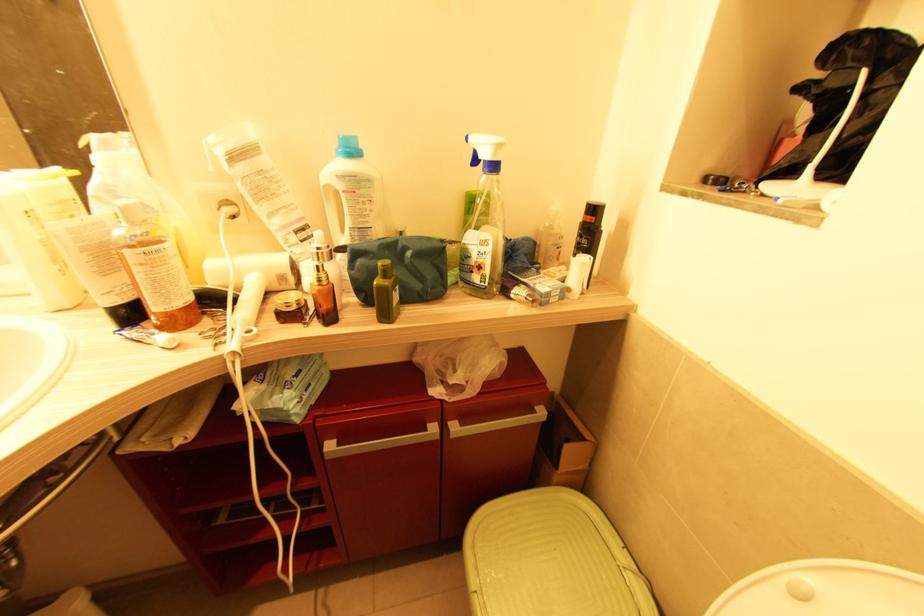
This screenshot has height=616, width=924. What do you see at coordinates (385, 293) in the screenshot?
I see `the small green bottle` at bounding box center [385, 293].